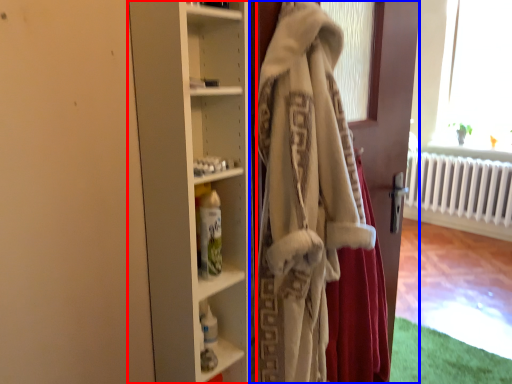
Question: Which of the following is the closest to the observer, cupboard (highlighted by a red box) or door (highlighted by a blue box)?

Choices:
 (A) cupboard
 (B) door

Answer: (B)